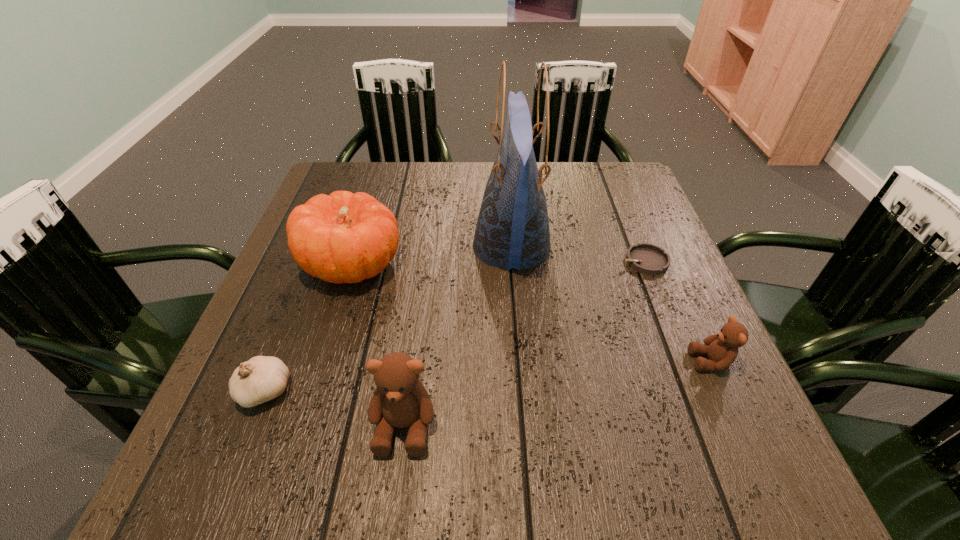
Where is `teddy bear present at the right edge`? This screenshot has height=540, width=960. teddy bear present at the right edge is located at coordinates (722, 349).

This screenshot has width=960, height=540. What are the coordinates of `ashtray that is at the right edge` in the screenshot? It's located at (648, 259).

The width and height of the screenshot is (960, 540). In order to click on object at the near left corner in this screenshot , I will do `click(262, 378)`.

Locate an element on the screen. This screenshot has width=960, height=540. free spot at the far edge of the desktop is located at coordinates (430, 167).

Image resolution: width=960 pixels, height=540 pixels. I want to click on blank space at the near edge, so click(509, 410).

Locate an element on the screen. vacant space at the left edge of the desktop is located at coordinates (299, 281).

The width and height of the screenshot is (960, 540). I want to click on vacant space at the right edge, so click(x=678, y=345).

Where is `vacant space at the far left corner of the desktop`? vacant space at the far left corner of the desktop is located at coordinates (378, 171).

The height and width of the screenshot is (540, 960). Find the location of `vacant area at the near right corner`. vacant area at the near right corner is located at coordinates (684, 384).

This screenshot has height=540, width=960. Identify the location of vacant space that's between the shorter teddy bear and the garlic. (488, 376).